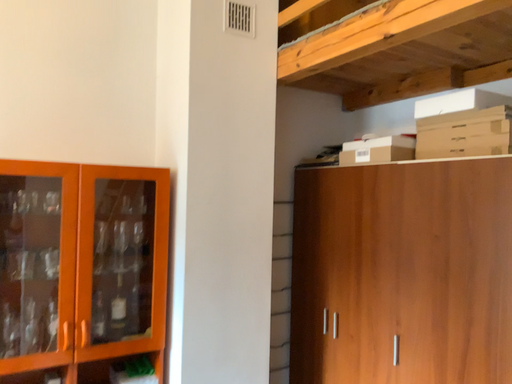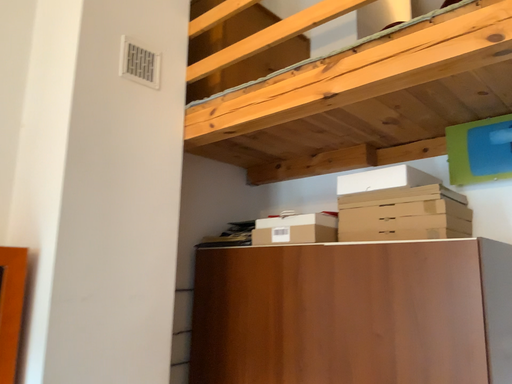
Question: Which way did the camera rotate in the video?

Choices:
 (A) rotated right
 (B) rotated left

Answer: (A)